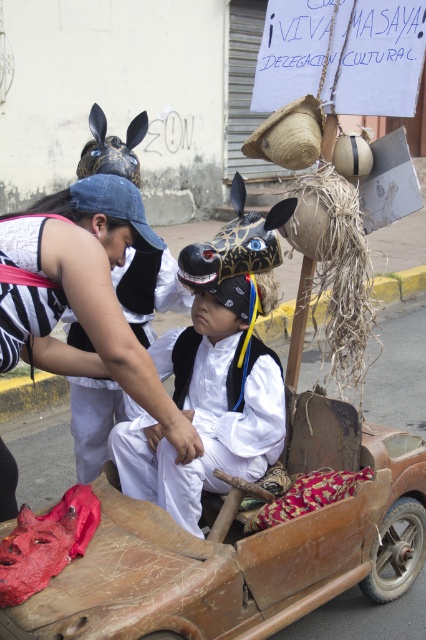
Question: Is white cotton shirt at center to the left of white matte vest at center from the viewer's perspective?

Choices:
 (A) no
 (B) yes

Answer: (B)

Question: Is white cotton shirt at center positioned in front of white matte vest at center?

Choices:
 (A) no
 (B) yes

Answer: (B)

Question: Is white cotton shirt at center positioned behind white matte vest at center?

Choices:
 (A) yes
 (B) no

Answer: (B)

Question: Among these objects, which one is nearest to the camera?

Choices:
 (A) white cotton shirt at center
 (B) white matte vest at center

Answer: (A)

Question: Which point is closer to the camera?

Choices:
 (A) white cotton shirt at center
 (B) white matte vest at center

Answer: (A)